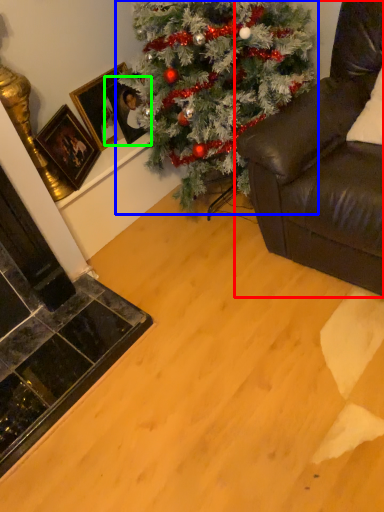
Question: Based on their relative distances, which object is farther from studio couch (highlighted by a red box)? Choose from christmas tree (highlighted by a blue box) and picture frame (highlighted by a green box).

Choices:
 (A) christmas tree
 (B) picture frame

Answer: (B)